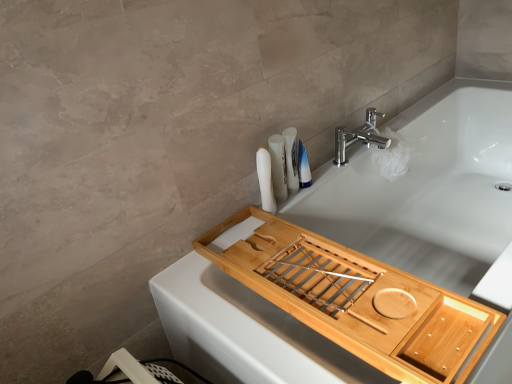
Question: Is chrome/metallic faucet at upper right directly adjacent to blue glossy bottle at upper right, which ranks as the 3th toiletry in left-to-right order?

Choices:
 (A) yes
 (B) no

Answer: (B)

Question: From a real-world perspective, is chrome/metallic faucet at upper right positioned under blue glossy bottle at upper right, which ranks as the 3th toiletry in left-to-right order, based on gravity?

Choices:
 (A) no
 (B) yes

Answer: (B)

Question: Considering the relative sizes of chrome/metallic faucet at upper right and blue glossy bottle at upper right, which appears as the first toiletry when viewed from the right, in the image provided, is chrome/metallic faucet at upper right taller than blue glossy bottle at upper right, which appears as the first toiletry when viewed from the right,?

Choices:
 (A) no
 (B) yes

Answer: (A)

Question: Does chrome/metallic faucet at upper right have a lesser width compared to blue glossy bottle at upper right, which appears as the first toiletry when viewed from the right?

Choices:
 (A) no
 (B) yes

Answer: (A)

Question: Is chrome/metallic faucet at upper right looking in the opposite direction of blue glossy bottle at upper right, which ranks as the 3th toiletry in left-to-right order?

Choices:
 (A) no
 (B) yes

Answer: (A)

Question: From their relative heights in the image, would you say chrome/metallic faucet at upper right is taller or shorter than natural wood tray at upper right?

Choices:
 (A) short
 (B) tall

Answer: (B)

Question: Is chrome/metallic faucet at upper right in front of or behind natural wood tray at upper right in the image?

Choices:
 (A) front
 (B) behind

Answer: (B)

Question: From a real-world perspective, is chrome/metallic faucet at upper right positioned above or below natural wood tray at upper right?

Choices:
 (A) above
 (B) below

Answer: (A)

Question: Would you say chrome/metallic faucet at upper right is to the left or to the right of natural wood tray at upper right in the picture?

Choices:
 (A) left
 (B) right

Answer: (B)

Question: Is natural wood tray at upper right inside the boundaries of blue glossy bottle at upper right, which ranks as the 3th toiletry in left-to-right order, or outside?

Choices:
 (A) inside
 (B) outside

Answer: (B)

Question: From a real-world perspective, is natural wood tray at upper right physically located above or below blue glossy bottle at upper right, which ranks as the 3th toiletry in left-to-right order?

Choices:
 (A) below
 (B) above

Answer: (A)

Question: Based on their positions, is natural wood tray at upper right located to the left or right of blue glossy bottle at upper right, which ranks as the 3th toiletry in left-to-right order?

Choices:
 (A) right
 (B) left

Answer: (B)

Question: From the image's perspective, is natural wood tray at upper right above or below blue glossy bottle at upper right, which ranks as the 3th toiletry in left-to-right order?

Choices:
 (A) above
 (B) below

Answer: (B)

Question: Is white matte bathtub at upper center taller or shorter than white matte toothbrushes at upper right, positioned as the 2th toiletry in left-to-right order?

Choices:
 (A) short
 (B) tall

Answer: (B)

Question: From the image's perspective, is white matte bathtub at upper center located above or below white matte toothbrushes at upper right, positioned as the 2th toiletry in left-to-right order?

Choices:
 (A) above
 (B) below

Answer: (B)